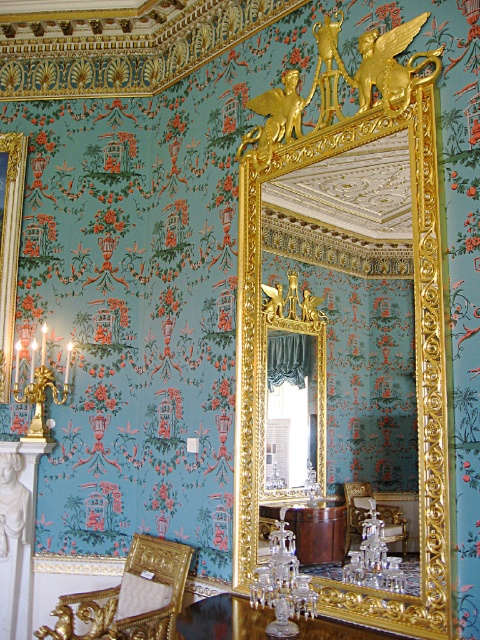
You are a guest in this room and want to sit down. You see the gold upholstered chair at lower left and the brown polished wood table at center. Which object is closer to the entrance if you entered from the lower right corner of the image?

The gold upholstered chair at lower left is closer to the entrance because it is positioned on the left side of the brown polished wood table at center, which would place it nearer to the entrance located at the lower right corner.

You are standing in the center of the room and see the point at coordinates (130,596). Which object is this point located on?

The point at coordinates (130,596) is located on the gold upholstered chair at lower left.